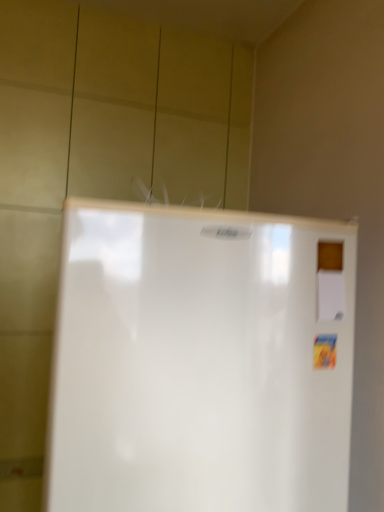
Describe the element at coordinates (201, 361) in the screenshot. I see `white glossy refrigerator at center` at that location.

Where is `white glossy refrigerator at center`? This screenshot has height=512, width=384. white glossy refrigerator at center is located at coordinates (201, 361).

Where is `white glossy refrigerator at center`? The height and width of the screenshot is (512, 384). white glossy refrigerator at center is located at coordinates (201, 361).